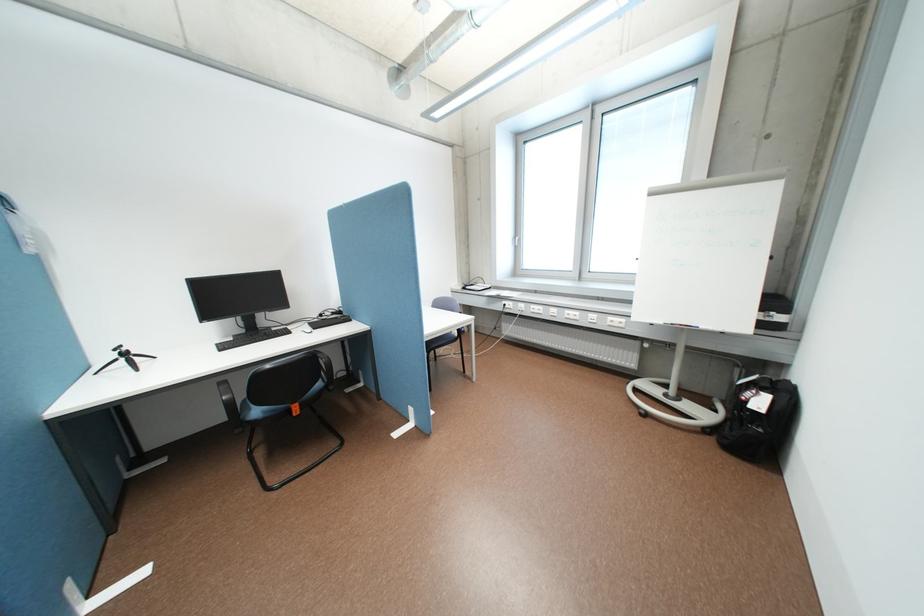
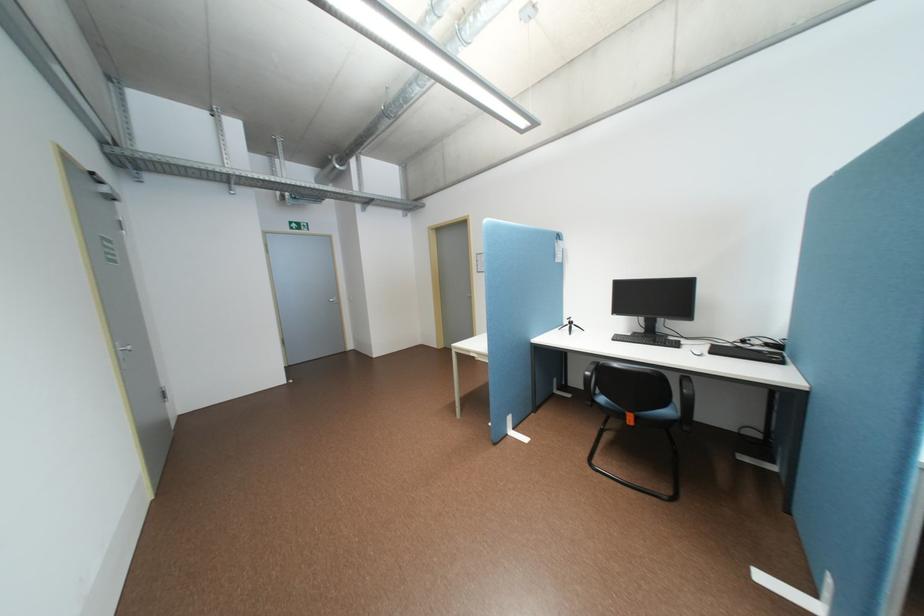
In the second image, find the point that corresponds to [300,331] in the first image.

(688, 346)